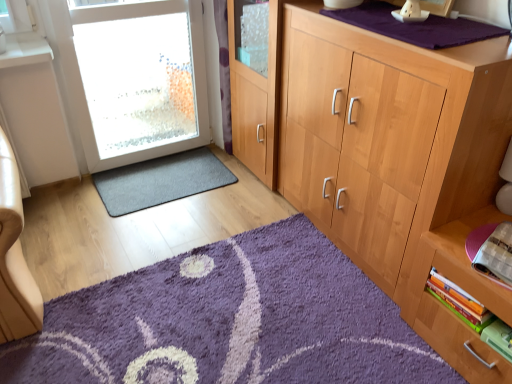
Question: Looking at the image, does purple shaggy rug at lower center, the 2th doormat from the top, seem bigger or smaller compared to hardcover book at lower right, which appears as the 3th book when ordered from the bottom?

Choices:
 (A) small
 (B) big

Answer: (B)

Question: Would you say purple shaggy rug at lower center, the 2th doormat from the top, is to the left or to the right of hardcover book at lower right, which appears as the 3th book when ordered from the bottom, in the picture?

Choices:
 (A) left
 (B) right

Answer: (A)

Question: Considering the real-world distances, which object is closest to the hardcover book at lower right, which appears as the 3th book when ordered from the bottom?

Choices:
 (A) wooden books at lower right
 (B) purple shaggy rug at lower center, the second doormat positioned from the back
 (C) hardcover book at lower right, which is the 2th book from top to bottom
 (D) dark gray carpet at lower left, which is the first doormat in top-to-bottom order
 (E) green matte book at lower right, the 3th book in the top-to-bottom sequence

Answer: (A)

Question: Which object is the closest to the light wood cabinet at center right?

Choices:
 (A) wooden books at lower right
 (B) green matte book at lower right, which is the first book from bottom to top
 (C) white frosted glass door at left
 (D) dark gray carpet at lower left, which is the first doormat in top-to-bottom order
 (E) purple shaggy rug at lower center, which appears as the 1th doormat when ordered from the bottom

Answer: (A)